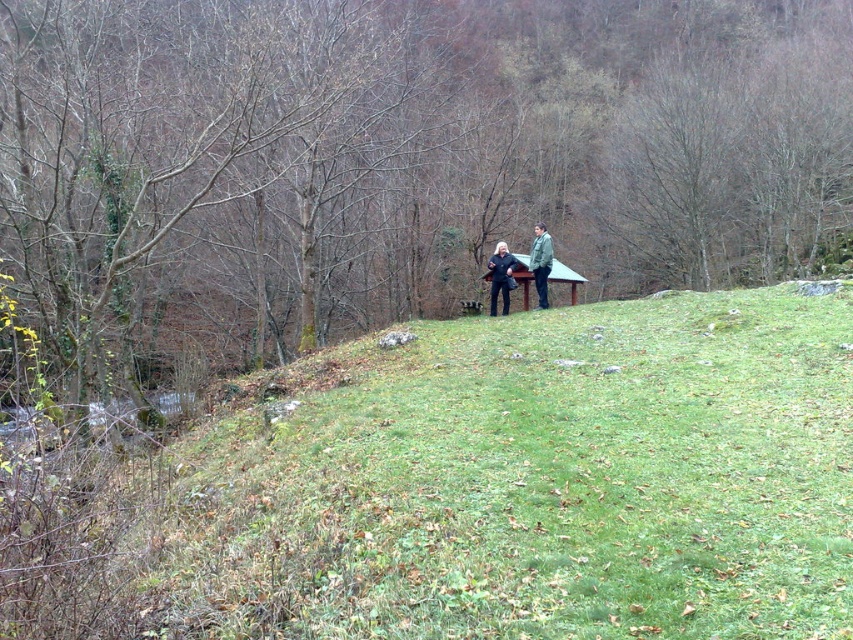
Between black matte jacket at center and dark green fabric jacket at center, which one is positioned higher?

dark green fabric jacket at center is above.

You are a GUI agent. You are given a task and a screenshot of the screen. Output one action in this format:
    pyautogui.click(x=<x>, y=<y>)
    Task: Click on the black matte jacket at center
    The image size is (853, 640).
    Given the screenshot: What is the action you would take?
    pyautogui.click(x=500, y=276)

Between point (494, 308) and point (544, 307), which one is positioned behind?

The point (494, 308) is more distant.

What are the coordinates of `black matte jacket at center` in the screenshot? It's located at (500, 276).

Who is taller, brown bark tree at center or black matte jacket at center?

brown bark tree at center

Is brown bark tree at center wider than black matte jacket at center?

Yes.

Who is more forward, (299, 324) or (498, 252)?

Point (498, 252) is in front.

The height and width of the screenshot is (640, 853). Identify the location of brown bark tree at center. click(x=399, y=157).

Measure the distance between green grassy hillside at center and dark green fabric jacket at center.

32.45 feet

Is the position of green grassy hillside at center less distant than that of dark green fabric jacket at center?

That is True.

Is point (637, 627) more distant than point (534, 241)?

No, it is not.

Locate an element on the screen. Image resolution: width=853 pixels, height=640 pixels. green grassy hillside at center is located at coordinates (529, 481).